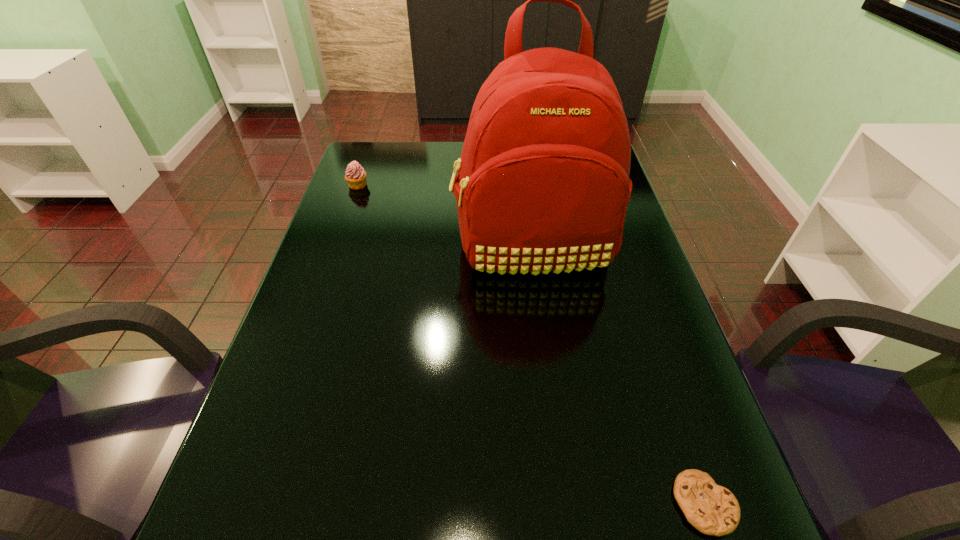
What are the coordinates of `free space between the cupcake and the tallest object` in the screenshot? It's located at (445, 217).

You are a GUI agent. You are given a task and a screenshot of the screen. Output one action in this format:
    pyautogui.click(x=<x>, y=<y>)
    Task: Click on the vacant space that's between the cupcake and the shortest object
    The height and width of the screenshot is (540, 960).
    Given the screenshot: What is the action you would take?
    pyautogui.click(x=531, y=345)

You are a GUI agent. You are given a task and a screenshot of the screen. Output one action in this format:
    pyautogui.click(x=<x>, y=<y>)
    Task: Click on the empty space that is in between the nearest object and the second nearest object
    This screenshot has width=960, height=540.
    Given the screenshot: What is the action you would take?
    pyautogui.click(x=618, y=376)

The width and height of the screenshot is (960, 540). I want to click on free space between the second nearest object and the cookie, so click(618, 376).

What are the coordinates of `vacant area that lies between the leftmost object and the nearest object` in the screenshot? It's located at (531, 345).

This screenshot has width=960, height=540. In order to click on vacant point located between the cupcake and the tallest object in this screenshot , I will do `click(445, 217)`.

Point out which object is positioned as the second nearest to the tallest object. Please provide its 2D coordinates. Your answer should be formatted as a tuple, i.e. [(x, y)], where the tuple contains the x and y coordinates of a point satisfying the conditions above.

[(712, 509)]

Locate which object is the closest to the leftmost object. Please provide its 2D coordinates. Your answer should be formatted as a tuple, i.e. [(x, y)], where the tuple contains the x and y coordinates of a point satisfying the conditions above.

[(543, 185)]

Find the location of a particular element. The width and height of the screenshot is (960, 540). vacant space that satisfies the following two spatial constraints: 1. on the front-facing side of the nearest object; 2. on the left side of the second farthest object is located at coordinates (565, 504).

The width and height of the screenshot is (960, 540). I want to click on vacant space that satisfies the following two spatial constraints: 1. on the front-facing side of the backpack; 2. on the left side of the nearest object, so click(x=565, y=504).